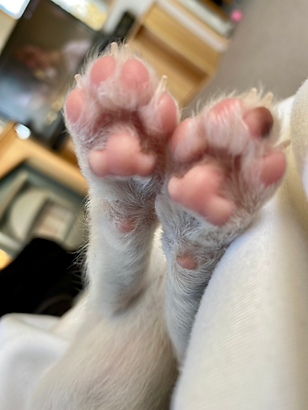
The height and width of the screenshot is (410, 308). What are the coordinates of `tv` in the screenshot? It's located at (32, 34).